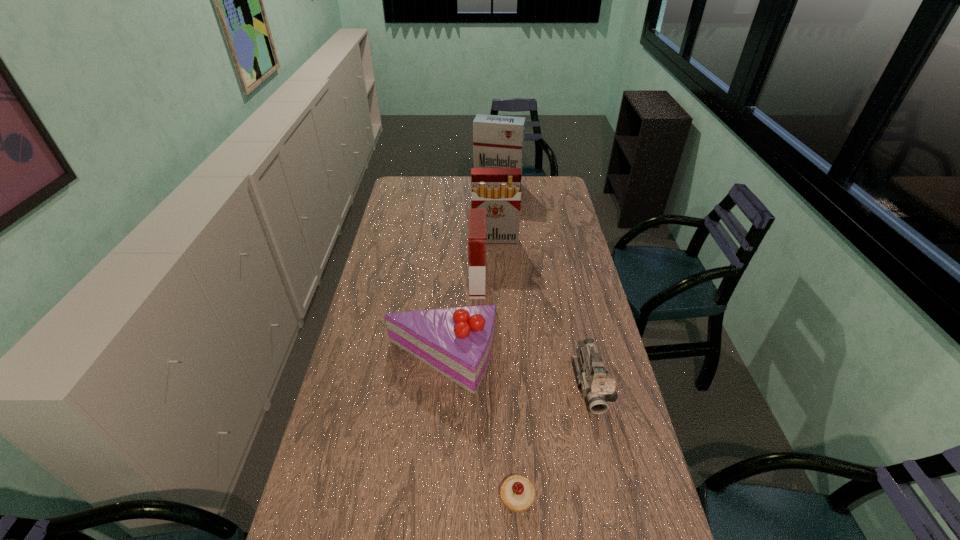
You are a GUI agent. You are given a task and a screenshot of the screen. Output one action in this format:
    pyautogui.click(x=<x>, y=<y>)
    Task: Click on the vacant space at the far right corner of the desktop
    The width and height of the screenshot is (960, 540).
    Given the screenshot: What is the action you would take?
    pyautogui.click(x=542, y=195)

The image size is (960, 540). Identify the location of empty space between the nearest object and the fourth nearest object. (497, 390).

Locate an element on the screen. free spot between the pastry and the nearest cigarette_case is located at coordinates (497, 390).

This screenshot has width=960, height=540. Identify the location of free space between the cake and the second farthest object. (468, 300).

The width and height of the screenshot is (960, 540). Find the location of `free point between the nearest cigarette_case and the shortest object`. free point between the nearest cigarette_case and the shortest object is located at coordinates (497, 390).

The image size is (960, 540). Find the location of `vacant area that lies between the nearest object and the nearest cigarette_case`. vacant area that lies between the nearest object and the nearest cigarette_case is located at coordinates tap(497, 390).

The width and height of the screenshot is (960, 540). Find the location of `free area in between the pastry and the cake`. free area in between the pastry and the cake is located at coordinates (479, 429).

Locate an element on the screen. This screenshot has width=960, height=540. object that stands as the closest to the pastry is located at coordinates (596, 383).

Find the location of `object that is the third nearest to the rightmost object`. object that is the third nearest to the rightmost object is located at coordinates (477, 217).

Locate an element on the screen. cigarette_case that can be found as the second closest to the farthest cigarette_case is located at coordinates (477, 217).